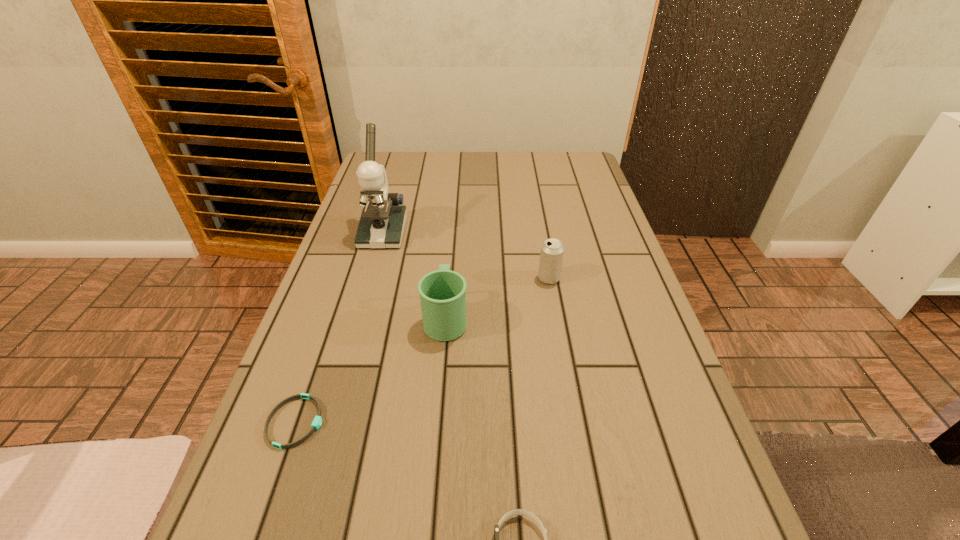
Identify the location of the farthest object. (382, 222).

Identify the location of microscope. (382, 222).

Where is `mug`? The width and height of the screenshot is (960, 540). mug is located at coordinates (442, 292).

The height and width of the screenshot is (540, 960). I want to click on the third farthest object, so click(x=442, y=292).

The width and height of the screenshot is (960, 540). Find the location of `the second farthest object`. the second farthest object is located at coordinates (551, 256).

At what (x,y) coordinates should I click in order to perform the action: click on the rightmost object. Please return your answer as a coordinate pair (x, y). The image size is (960, 540). Looking at the image, I should click on (551, 256).

Identify the location of the farther wristband. (316, 424).

This screenshot has width=960, height=540. Find the location of `the fourth farthest object`. the fourth farthest object is located at coordinates (316, 424).

Where is `free location located at the eyepiece of the farthest object`? The image size is (960, 540). free location located at the eyepiece of the farthest object is located at coordinates [365, 294].

This screenshot has width=960, height=540. In order to click on free location located 0.170m on the side of the third nearest object with the handle in this screenshot , I will do `click(451, 251)`.